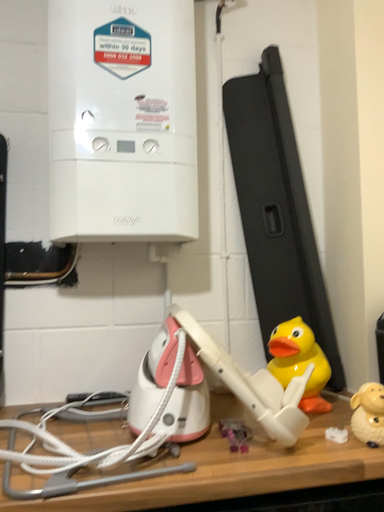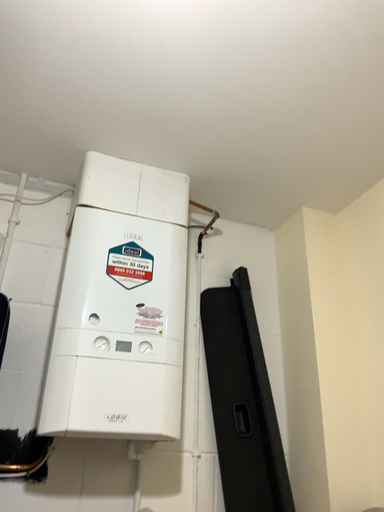
Question: Which way did the camera rotate in the video?

Choices:
 (A) rotated upward
 (B) rotated downward

Answer: (A)